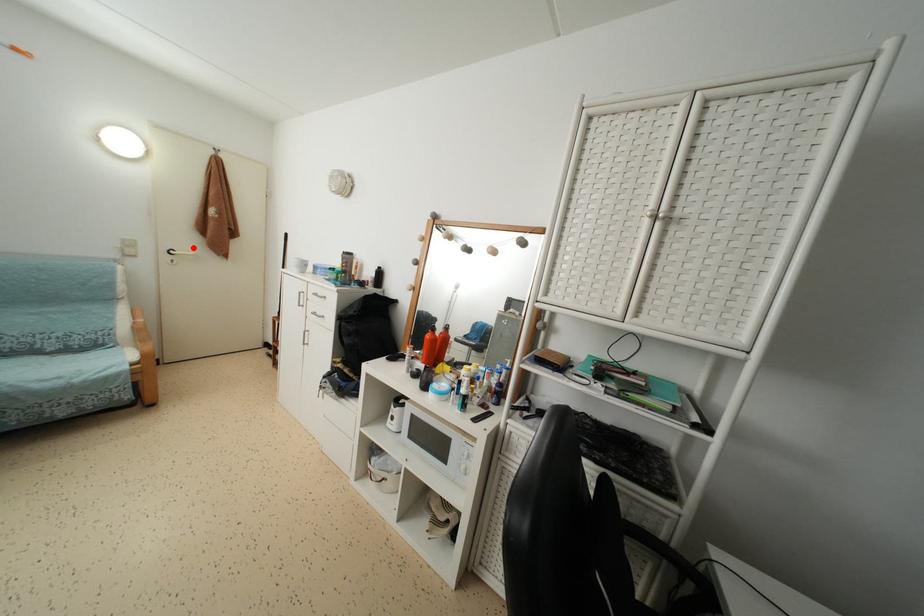
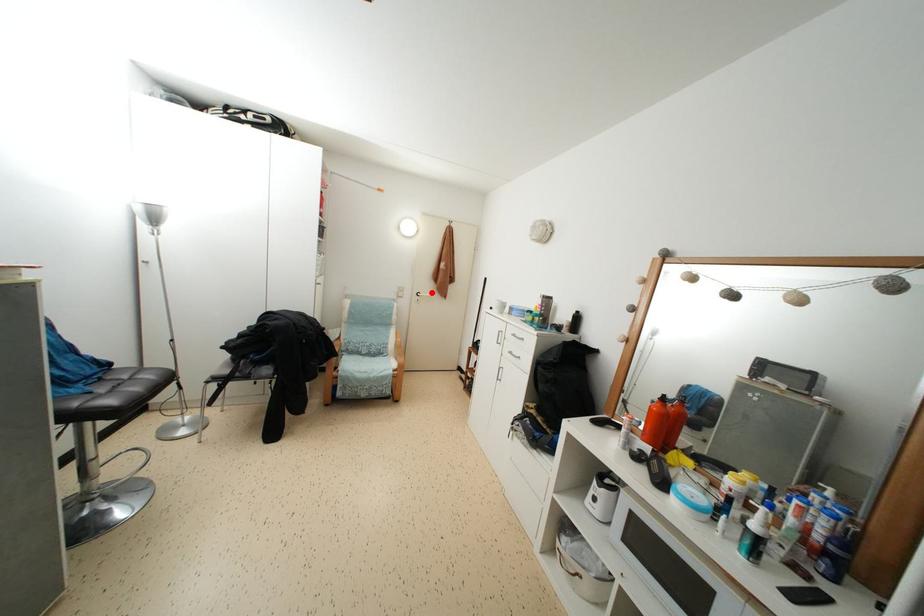
I am providing you with two images of the same scene from different viewpoints. A red point is marked on the first image and another point is marked on the second image. Is the marked point in image1 the same physical position as the marked point in image2?

Yes